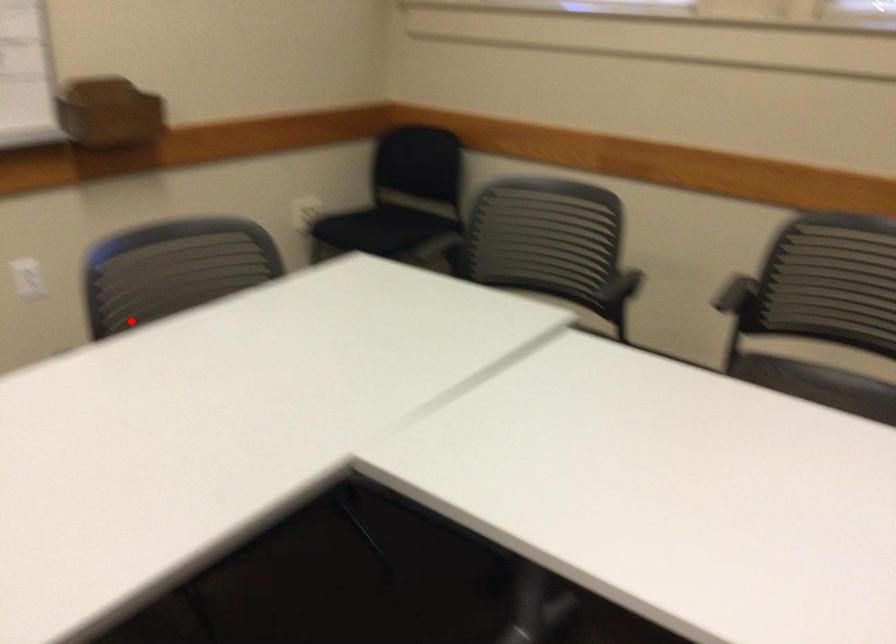
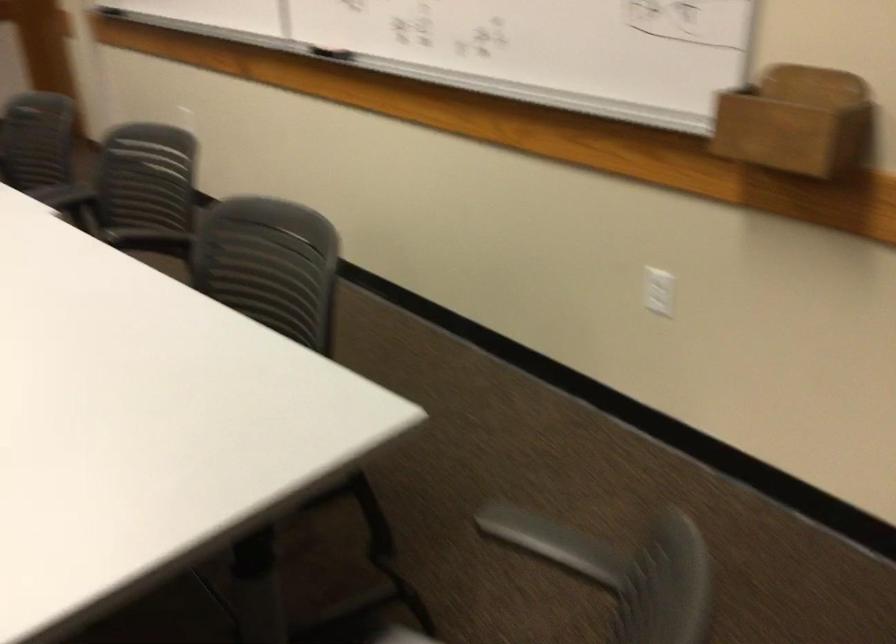
In the second image, find the point that corresponds to the highlighted location in the first image.

(270, 289)